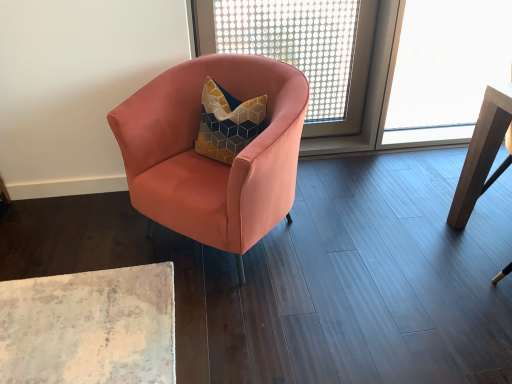
Where is `free point to the left of matte pink armchair at center`? free point to the left of matte pink armchair at center is located at coordinates (80, 246).